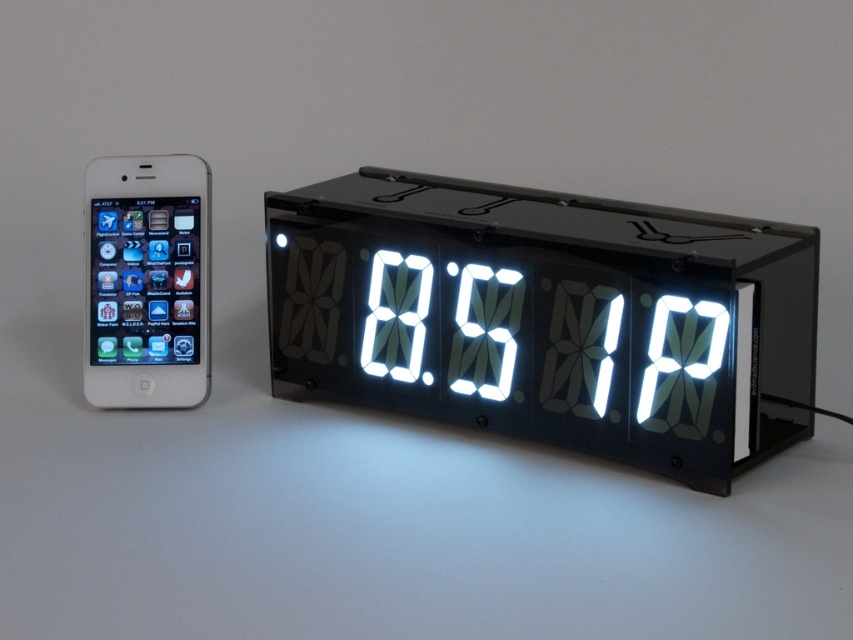
You are standing 4 feet away from the white led display at center. Can you reach it without moving your feet?

The white led display at center is 3.77 feet away from the camera, so yes, you can reach it without moving your feet since you are standing 4 feet away, which is slightly farther than the display distance.

You are setting up a desk for a video call. You have a white glossy smartphone at left and a white led display at center. The display is 14.16 inches away from the smartphone. If your desk is 24 inches wide, will both items fit side by side without overlapping?

The white led display at center is 14.16 inches from the white glossy smartphone at left. Since the desk is 24 inches wide, and the combined space they occupy is less than 24 inches, both items will fit side by side without overlapping.

You are setting up a shelf and want to place the white glossy smartphone at left and the white led display at center next to each other. Based on the image, which object should you place first to ensure they fit properly?

The white led display at center might be wider than white glossy smartphone at left, so you should place the white led display at center first to accommodate its width.